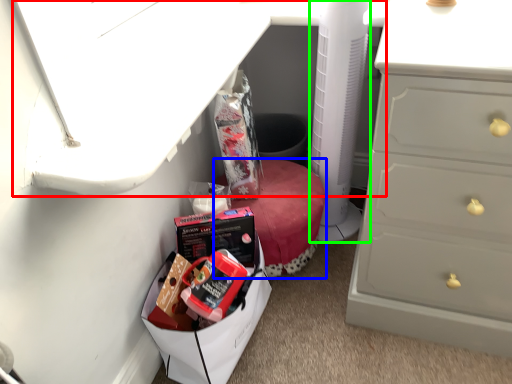
Question: Which object is positioned closest to vanity (highlighted by a red box)? Select from furniture (highlighted by a blue box) and appliance (highlighted by a green box).

Choices:
 (A) furniture
 (B) appliance

Answer: (B)